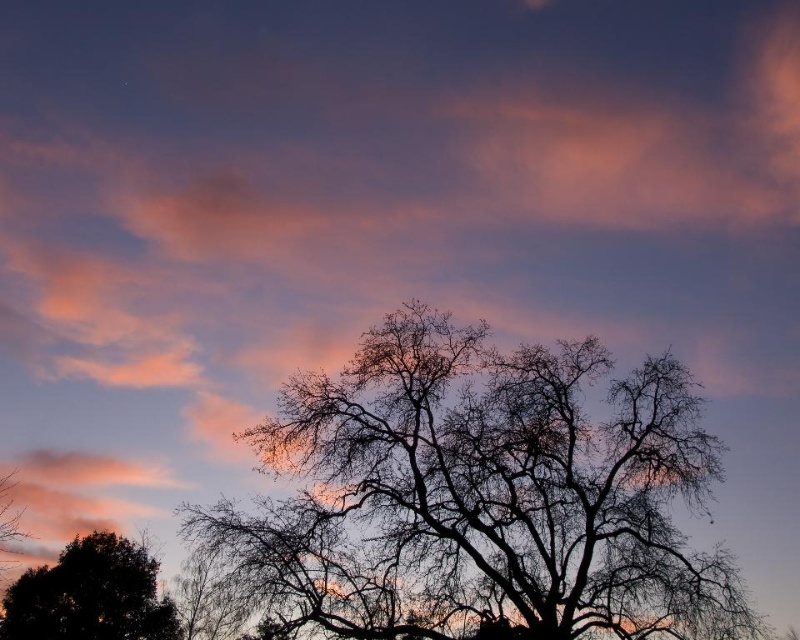
Does black silhouette tree at center come behind dark green leafy tree at lower left?

No, black silhouette tree at center is in front of dark green leafy tree at lower left.

You are a GUI agent. You are given a task and a screenshot of the screen. Output one action in this format:
    pyautogui.click(x=<x>, y=<y>)
    Task: Click on the black silhouette tree at center
    The image size is (800, 640).
    Given the screenshot: What is the action you would take?
    point(482,497)

The height and width of the screenshot is (640, 800). I want to click on black silhouette tree at center, so click(x=482, y=497).